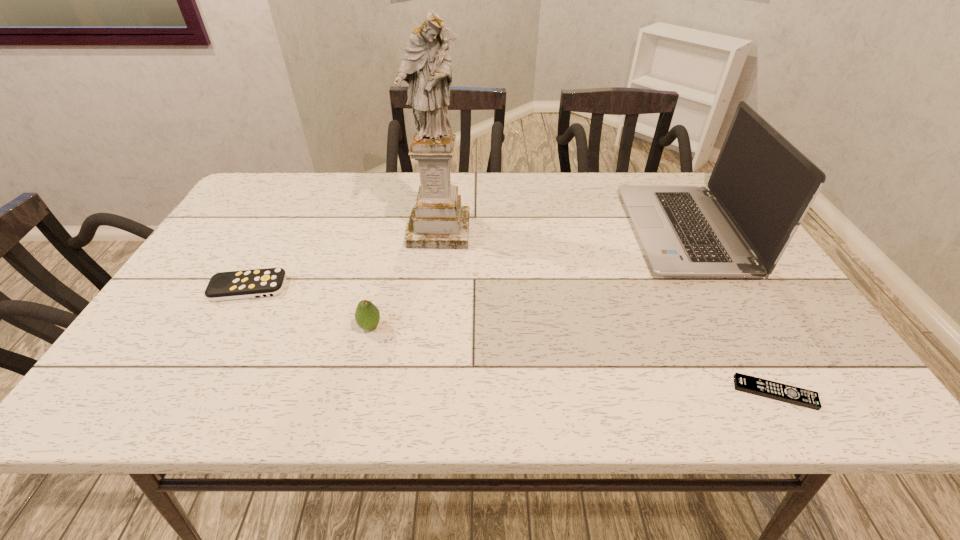
I want to click on free region located on the screen of the second tallest object, so click(x=543, y=231).

Find the location of `vacant space located 0.280m on the screen of the second tallest object`. vacant space located 0.280m on the screen of the second tallest object is located at coordinates (533, 231).

Image resolution: width=960 pixels, height=540 pixels. What are the coordinates of `vacant space located on the screen of the second tallest object` in the screenshot? It's located at (512, 231).

Image resolution: width=960 pixels, height=540 pixels. What are the coordinates of `vacant space located on the back of the second nearest object` in the screenshot? It's located at (388, 251).

This screenshot has width=960, height=540. In order to click on vacant space located on the front of the leftmost object in this screenshot , I will do `click(231, 319)`.

You are a GUI agent. You are given a task and a screenshot of the screen. Output one action in this format:
    pyautogui.click(x=<x>, y=<y>)
    Task: Click on the vacant space located on the left of the right remote control
    The image size is (960, 540).
    Given the screenshot: What is the action you would take?
    pyautogui.click(x=598, y=393)

Where is `sculpture that is at the far edge`? This screenshot has height=540, width=960. sculpture that is at the far edge is located at coordinates (438, 221).

Locate an element on the screen. This screenshot has width=960, height=540. laptop computer present at the far edge is located at coordinates (761, 187).

Locate an element on the screen. This screenshot has height=540, width=960. object that is positioned at the near edge is located at coordinates (769, 389).

At what (x,y) coordinates should I click in order to perform the action: click on object at the left edge. Please return your answer as a coordinate pair (x, y). Looking at the image, I should click on (232, 285).